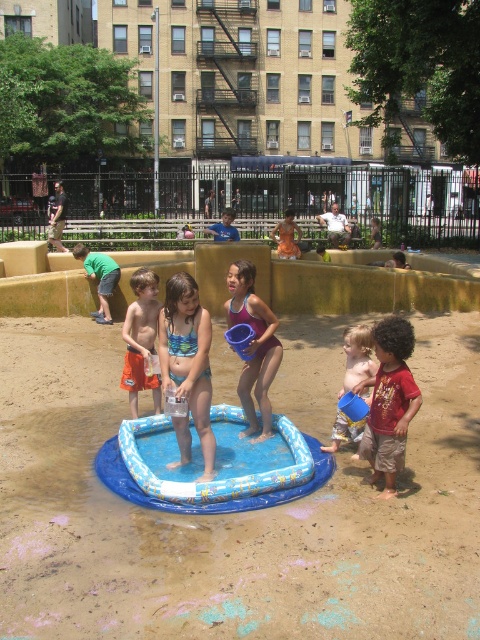
You are a parent supervising children at the park. You need to ensure that the blue printed swimsuit at center and the orange swim trunks at center can both fit on a 1.2 meter wide bench. Given their widths, will they be able to sit side by side comfortably?

The blue printed swimsuit at center is wider than the orange swim trunks at center. However, since the bench is 1.2 meters wide, they should be able to sit side by side comfortably as long as their combined widths do not exceed the bench length. Unfortunately, the exact widths are not provided, so we cannot confirm for sure.

You are a parent at the park and want to locate your child wearing the orange swim trunks at center. Which direction should you look relative to the blue printed swimsuit at center?

The orange swim trunks at center is on the left side of the blue printed swimsuit at center, so you should look to the left of the blue printed swimsuit at center to find the orange swim trunks at center.